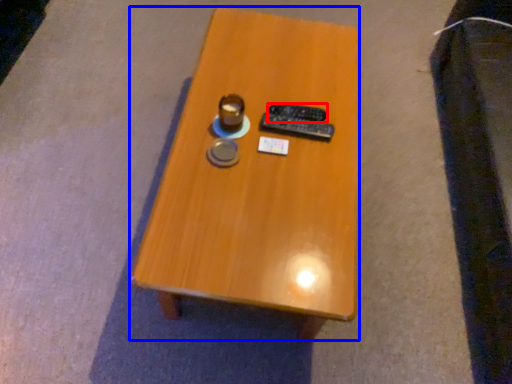
Question: Which point is closer to the camera, remote control (highlighted by a red box) or table (highlighted by a blue box)?

Choices:
 (A) remote control
 (B) table

Answer: (B)